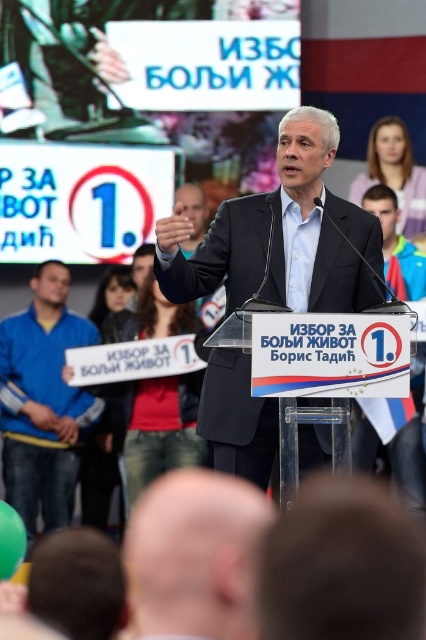
You are a photographer at a political rally. You need to capture a photo where the matte black suit at center and the blue fabric sign at left are both visible. Based on their positions, which object should you place on the right side of your frame to ensure both are included?

The matte black suit at center is positioned on the right side of blue fabric sign at left. To include both in the photo, you should place the blue fabric sign at left on the right side of your frame, allowing the matte black suit at center to naturally appear to its right.

You are attending a political rally and notice two items of interest. The first is the matte black suit at center worn by the speaker, and the second is the blue fabric sign at left displayed on the podium. Which object appears taller in the image?

The blue fabric sign at left appears taller than the matte black suit at center because the description states that the matte black suit at center is not as tall as the blue fabric sign at left.

You are a photographer at the event and want to capture a photo of the speaker at the podium. You are currently positioned at the denim jeans at center. Where should you move to get a clear shot of the speaker?

Since the denim jeans at center is located at point (x=158, y=426), you should move towards the podium to get a clear shot of the speaker.